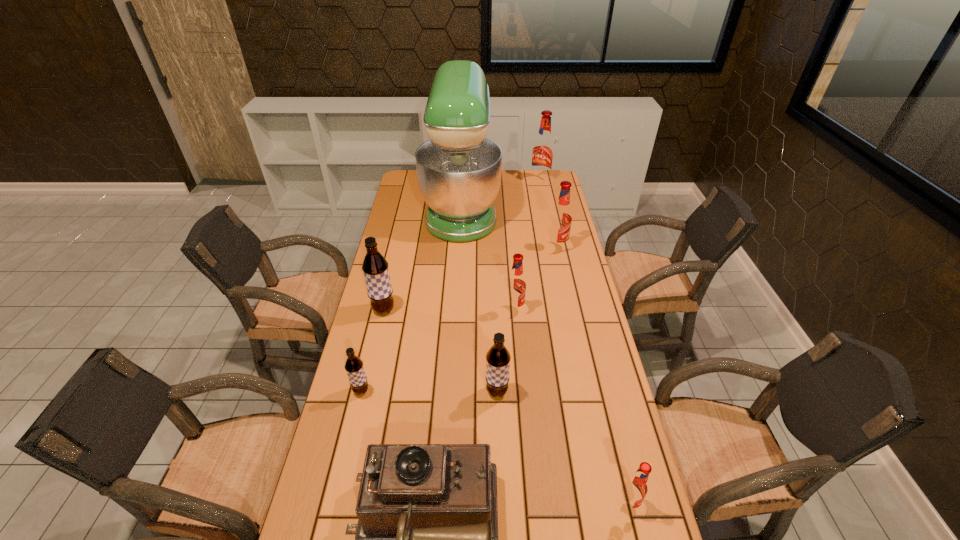
What are the coordinates of `the tallest object` in the screenshot? It's located at (459, 170).

At what (x,y) coordinates should I click in order to perform the action: click on mixer. Please return your answer as a coordinate pair (x, y). Looking at the image, I should click on (459, 170).

The width and height of the screenshot is (960, 540). Identify the location of the tallest root beer. (543, 149).

At what (x,y) coordinates should I click in order to perform the action: click on the farthest root beer. Please return your answer as a coordinate pair (x, y). Image resolution: width=960 pixels, height=540 pixels. Looking at the image, I should click on (543, 149).

This screenshot has width=960, height=540. Identify the location of the second farthest root beer. (561, 217).

This screenshot has width=960, height=540. Identify the location of the third nearest red root beer. (561, 217).

Identify the location of the farthest brown root beer. The height and width of the screenshot is (540, 960). (375, 267).

Where is `the third farthest red root beer`? the third farthest red root beer is located at coordinates (516, 284).

Where is `the leftmost red root beer`? The image size is (960, 540). the leftmost red root beer is located at coordinates (516, 284).

I want to click on the rightmost brown root beer, so click(x=498, y=358).